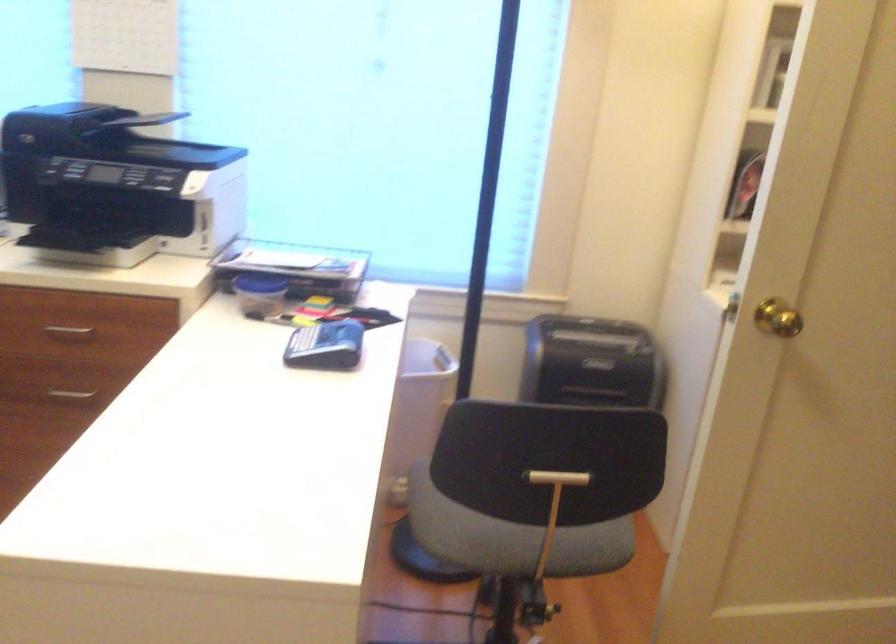
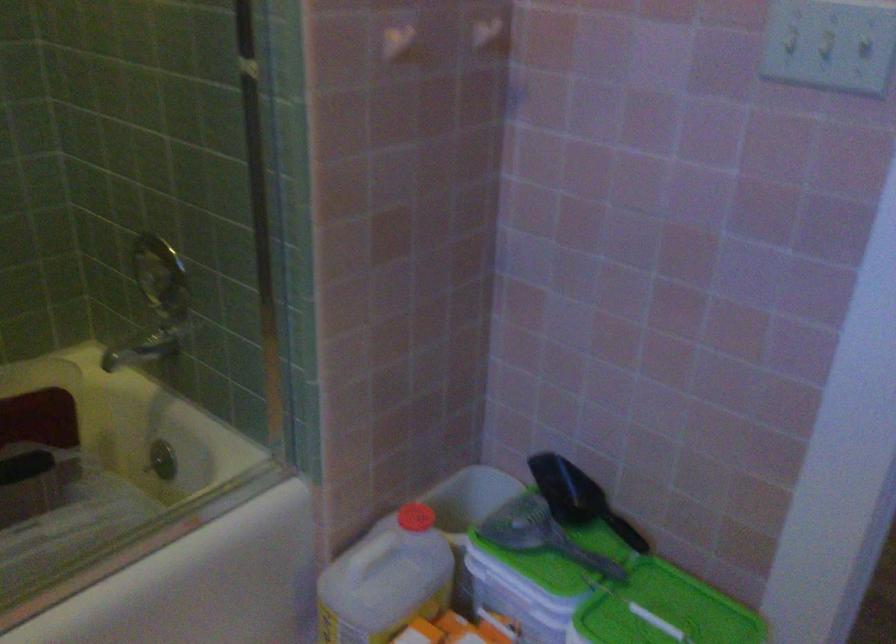
Question: I am providing you with two images of the same scene from different viewpoints. After the viewpoint changes to image2, which objects are now occluded?

Choices:
 (A) red umbrella
 (B) red bottle cap
 (C) silver drawer handle
 (D) light switch

Answer: (C)